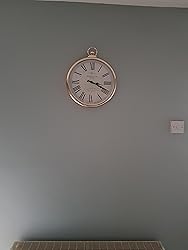
In order to click on shadow above radiator in this screenshot , I will do `click(90, 236)`.